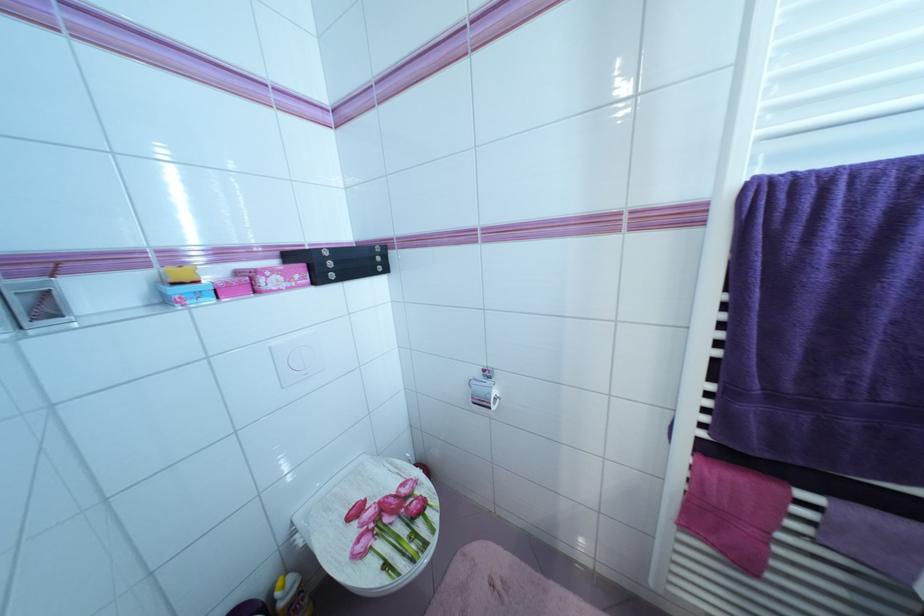
Locate an element on the screen. This screenshot has height=616, width=924. toilet paper roll is located at coordinates (483, 392).